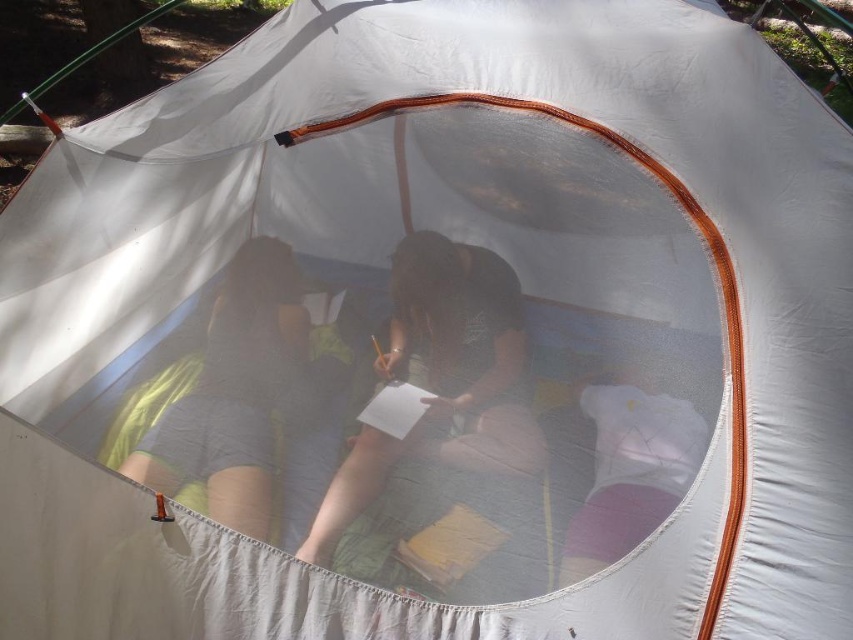
You are a designer trying to create a layout for a small tent interior. You need to place a dark brown fabric at center and a green fabric shorts at left. Given their sizes, which object requires more horizontal space?

The dark brown fabric at center requires more horizontal space because its width is larger than the green fabric shorts at left.

You are a photographer inside the tent and want to take a photo of the dark brown fabric at center and the green fabric shorts at left. Which object should you focus on first if you want to capture both clearly in the same frame?

The dark brown fabric at center is below the green fabric shorts at left, so you should focus on the green fabric shorts at left first to ensure both are in focus.